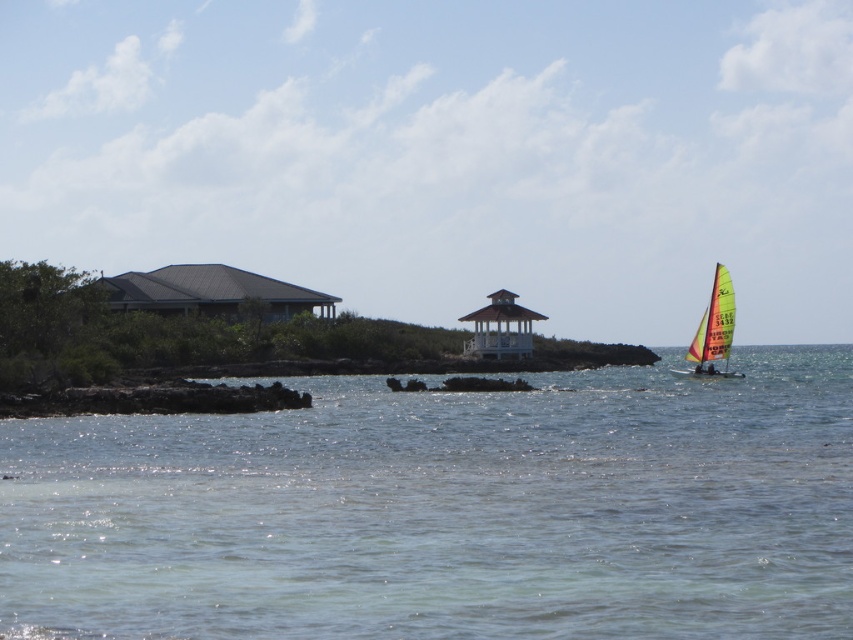
Question: Which of the following is the closest to the observer?

Choices:
 (A) yellow-green sailboat at right
 (B) gray matte roof at upper left
 (C) clear water at center
 (D) white wooden gazebo at center

Answer: (C)

Question: Is clear water at center bigger than white wooden gazebo at center?

Choices:
 (A) no
 (B) yes

Answer: (B)

Question: Which object is closer to the camera taking this photo?

Choices:
 (A) clear water at center
 (B) gray matte roof at upper left
 (C) white wooden gazebo at center

Answer: (A)

Question: Is clear water at center thinner than yellow-green sailboat at right?

Choices:
 (A) no
 (B) yes

Answer: (A)

Question: Which point is farther from the camera taking this photo?

Choices:
 (A) (288, 285)
 (B) (543, 316)
 (C) (691, 371)

Answer: (A)

Question: Is clear water at center positioned in front of gray matte roof at upper left?

Choices:
 (A) yes
 (B) no

Answer: (A)